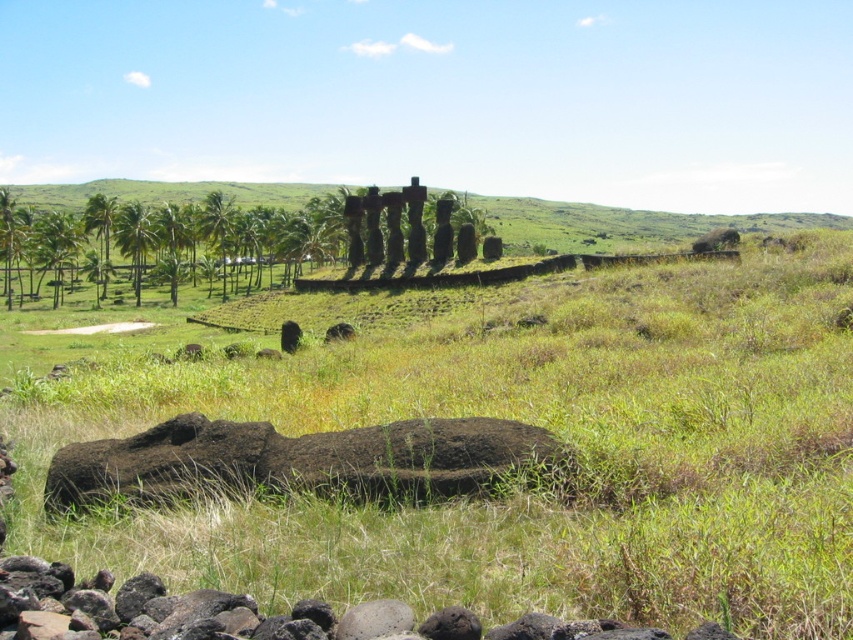
Does green grassy at center have a greater width compared to black rough rock at lower center?

Correct, the width of green grassy at center exceeds that of black rough rock at lower center.

From the picture: Does green grassy at center appear on the left side of black rough rock at lower center?

Incorrect, green grassy at center is not on the left side of black rough rock at lower center.

What do you see at coordinates (532, 422) in the screenshot?
I see `green grassy at center` at bounding box center [532, 422].

Where is `green grassy at center`? The height and width of the screenshot is (640, 853). green grassy at center is located at coordinates (532, 422).

How much distance is there between green grassy at center and green leafy palm tree at left?

green grassy at center and green leafy palm tree at left are 119.83 meters apart.

Who is higher up, green grassy at center or green leafy palm tree at left?

green leafy palm tree at left

Between point (724, 275) and point (222, 218), which one is positioned in front?

Point (724, 275) is in front.

Identify the location of green grassy at center. (532, 422).

Can you confirm if black rough rock at lower center is positioned to the right of green leafy palm tree at left?

Yes, black rough rock at lower center is to the right of green leafy palm tree at left.

Between point (514, 442) and point (204, 205), which one is positioned behind?

The point (204, 205) is more distant.

Between point (285, 449) and point (233, 228), which one is positioned in front?

Positioned in front is point (285, 449).

Where is `black rough rock at lower center`? This screenshot has height=640, width=853. black rough rock at lower center is located at coordinates (299, 460).